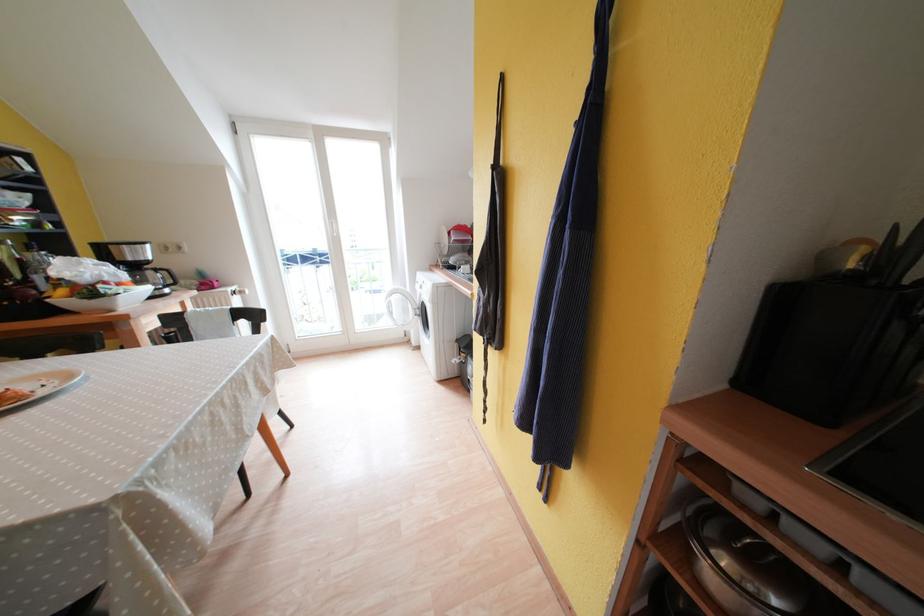
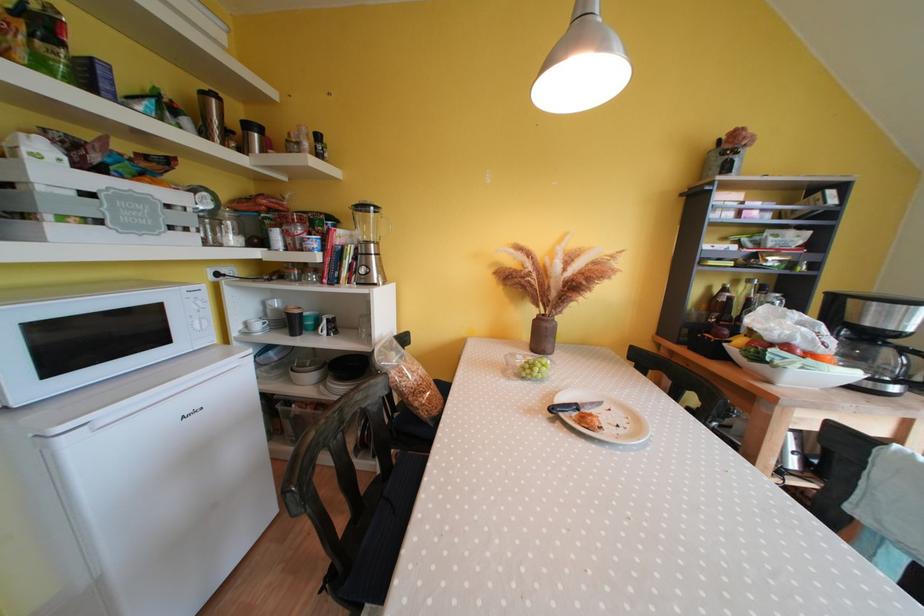
Based on the continuous images, in which direction is the camera rotating?

The camera rotated toward left-down.